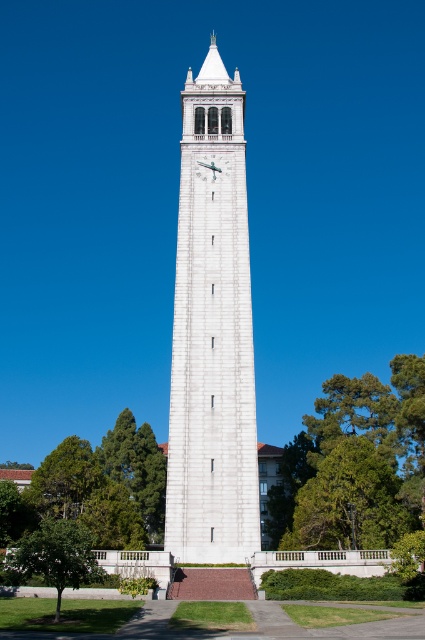
You are standing at the base of the clock tower and see two points marked on the tower. The first point is at coordinates point (342, 509) and the second is at point (201, 163). From your vantage point, which point appears closer to you?

Point (342, 509) is in front of point (201, 163), so it appears closer to you.

You are standing at the base of the clock tower and want to see the clock face clearly. Which tree, the green leafy tree at center or the green leafy tree at lower left, might block your view?

The green leafy tree at lower left is behind the green leafy tree at center, so the tree at center might block your view of the clock face.

You are standing at the base of the clock tower and want to take a photo of the white stone clock at center. To include the green leafy tree at lower left in your shot, should you pan your camera to the left or right?

The green leafy tree at lower left is to the left of the white stone clock at center, so you should pan your camera to the left to include both in your shot.